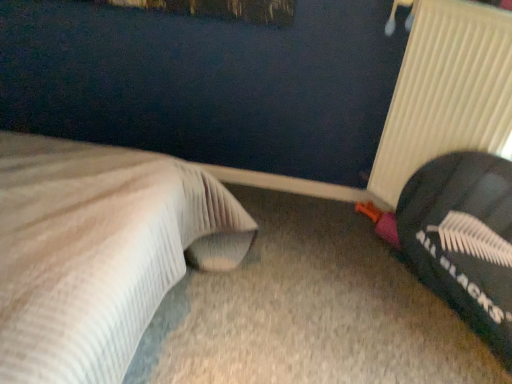
This screenshot has height=384, width=512. What do you see at coordinates (99, 252) in the screenshot?
I see `white textured bed at left` at bounding box center [99, 252].

This screenshot has height=384, width=512. In order to click on white textured bed at left in this screenshot , I will do `click(99, 252)`.

The width and height of the screenshot is (512, 384). What do you see at coordinates (460, 238) in the screenshot? I see `black fabric bean bag at right` at bounding box center [460, 238].

You are a GUI agent. You are given a task and a screenshot of the screen. Output one action in this format:
    pyautogui.click(x=<x>, y=<y>)
    Task: Click on the white textured bed at left
    
    Given the screenshot: What is the action you would take?
    pyautogui.click(x=99, y=252)

Is black fabric bean bag at right aimed at white ribbed radiator at right?

No, black fabric bean bag at right does not turn towards white ribbed radiator at right.

This screenshot has height=384, width=512. Find the location of `bean bag chair on the right side of white ribbed radiator at right`. bean bag chair on the right side of white ribbed radiator at right is located at coordinates (460, 238).

Looking at the image, does black fabric bean bag at right seem bigger or smaller compared to white ribbed radiator at right?

black fabric bean bag at right is bigger than white ribbed radiator at right.

Is white ribbed radiator at right in contact with white textured bed at left?

No, white ribbed radiator at right is not beside white textured bed at left.

From a real-world perspective, is white ribbed radiator at right on white textured bed at left?

Yes, from a real-world perspective, white ribbed radiator at right is over white textured bed at left

Is white ribbed radiator at right bigger or smaller than white textured bed at left?

In the image, white ribbed radiator at right appears to be smaller than white textured bed at left.

From the image's perspective, is white textured bed at left below white ribbed radiator at right?

Yes, from the image's perspective, white textured bed at left is below white ribbed radiator at right.

Looking at this image, which is more to the right, white textured bed at left or white ribbed radiator at right?

white ribbed radiator at right is more to the right.

Which object is wider, white textured bed at left or white ribbed radiator at right?

white textured bed at left is wider.

Would you say white textured bed at left is part of black fabric bean bag at right's contents?

No, white textured bed at left is not a part of black fabric bean bag at right.

Can you see black fabric bean bag at right touching white textured bed at left?

black fabric bean bag at right and white textured bed at left are clearly separated.

Consider the image. Is black fabric bean bag at right further to camera compared to white textured bed at left?

Yes, it is.

At what (x,y) coordinates should I click in order to perform the action: click on bean bag chair below the white textured bed at left (from a real-world perspective). Please return your answer as a coordinate pair (x, y). Looking at the image, I should click on (460, 238).

From a real-world perspective, which is physically above, white textured bed at left or black fabric bean bag at right?

white textured bed at left, from a real-world perspective.

Can you confirm if white textured bed at left is taller than black fabric bean bag at right?

Indeed, white textured bed at left has a greater height compared to black fabric bean bag at right.

From the image's perspective, which object appears higher, white textured bed at left or black fabric bean bag at right?

From the image's view, white textured bed at left is above.

In the scene shown: Choose the correct answer: Is white ribbed radiator at right inside black fabric bean bag at right or outside it?

white ribbed radiator at right is not enclosed by black fabric bean bag at right.

Can you tell me how much white ribbed radiator at right and black fabric bean bag at right differ in facing direction?

There is a 2.95-degree angle between the facing directions of white ribbed radiator at right and black fabric bean bag at right.

Considering the sizes of objects white ribbed radiator at right and black fabric bean bag at right in the image provided, who is bigger, white ribbed radiator at right or black fabric bean bag at right?

black fabric bean bag at right is bigger.

Which of these two, white ribbed radiator at right or black fabric bean bag at right, is thinner?

With smaller width is white ribbed radiator at right.

You are a GUI agent. You are given a task and a screenshot of the screen. Output one action in this format:
    pyautogui.click(x=<x>, y=<y>)
    Task: Click on the radiator on the left of black fabric bean bag at right
    The image size is (512, 384).
    Given the screenshot: What is the action you would take?
    pyautogui.click(x=446, y=92)

The image size is (512, 384). Find the location of `radiator above the white textured bed at left (from the image's perspective)`. radiator above the white textured bed at left (from the image's perspective) is located at coordinates (446, 92).

When comparing their distances from white textured bed at left, does black fabric bean bag at right or white ribbed radiator at right seem further?

white ribbed radiator at right is positioned further to the anchor white textured bed at left.

Which object lies further to the anchor point black fabric bean bag at right, white ribbed radiator at right or white textured bed at left?

white textured bed at left is positioned further to the anchor black fabric bean bag at right.

Based on their spatial positions, is black fabric bean bag at right or white textured bed at left closer to white ribbed radiator at right?

black fabric bean bag at right is closer to white ribbed radiator at right.

When comparing their distances from white textured bed at left, does white ribbed radiator at right or black fabric bean bag at right seem further?

white ribbed radiator at right is positioned further to the anchor white textured bed at left.

Estimate the real-world distances between objects in this image. Which object is closer to black fabric bean bag at right, white textured bed at left or white ribbed radiator at right?

white ribbed radiator at right lies closer to black fabric bean bag at right than the other object.

Which object lies further to the anchor point white ribbed radiator at right, white textured bed at left or black fabric bean bag at right?

Among the two, white textured bed at left is located further to white ribbed radiator at right.

Identify the location of radiator between white textured bed at left and black fabric bean bag at right. (446, 92).